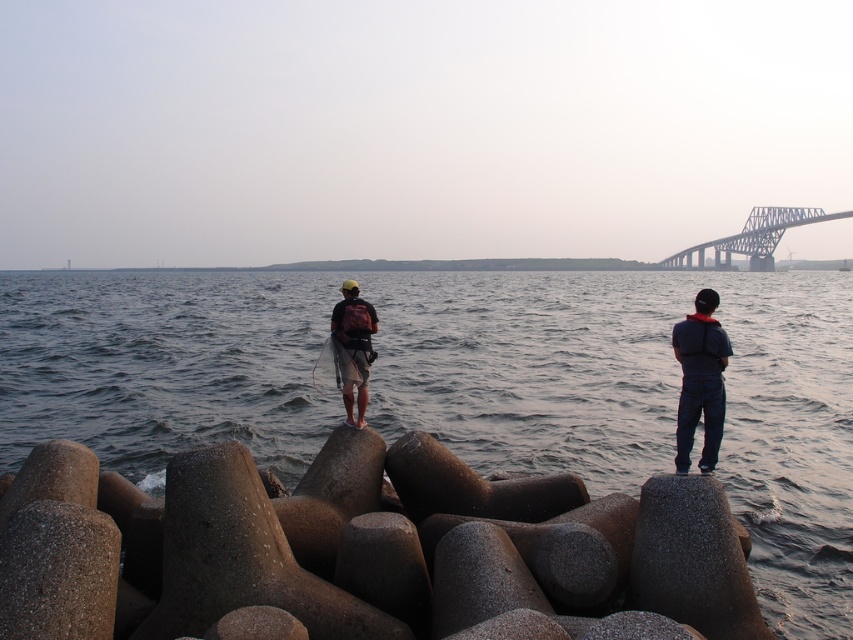
Question: Which of the following is the closest to the observer?

Choices:
 (A) (706, 368)
 (B) (350, 310)

Answer: (A)

Question: Can you confirm if gray metallic bridge at upper right is thinner than matte black backpack at center?

Choices:
 (A) no
 (B) yes

Answer: (A)

Question: Which object appears farthest from the camera in this image?

Choices:
 (A) matte black backpack at center
 (B) gray concrete water at center
 (C) gray metallic bridge at upper right
 (D) dark blue fabric jacket at right

Answer: (C)

Question: Which point is closer to the camera?

Choices:
 (A) (358, 397)
 (B) (693, 332)

Answer: (B)

Question: Is gray concrete water at center above matte black backpack at center?

Choices:
 (A) no
 (B) yes

Answer: (B)

Question: Can you confirm if gray concrete water at center is smaller than dark blue fabric jacket at right?

Choices:
 (A) no
 (B) yes

Answer: (A)